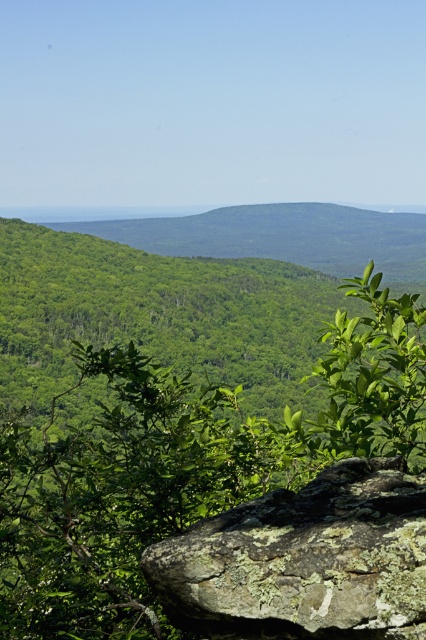
Question: Can you confirm if green leafy tree at center is positioned above lichen-covered rock at center?

Choices:
 (A) yes
 (B) no

Answer: (A)

Question: Which point is farther from the camera taking this photo?

Choices:
 (A) (314, 564)
 (B) (250, 280)

Answer: (B)

Question: Among these points, which one is farthest from the camera?

Choices:
 (A) (103, 596)
 (B) (322, 561)

Answer: (A)

Question: Which of the following is the farthest from the observer?

Choices:
 (A) green leafy tree at center
 (B) lichen-covered rock at center

Answer: (A)

Question: Where is green leafy tree at center located in relation to lichen-covered rock at center in the image?

Choices:
 (A) above
 (B) below

Answer: (A)

Question: Does green leafy tree at center appear under lichen-covered rock at center?

Choices:
 (A) yes
 (B) no

Answer: (B)